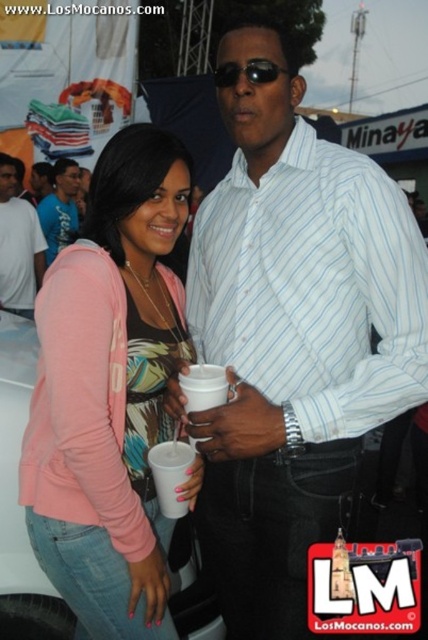
You are at an event and want to place both the white paper cup at center and the sunglasses at center into your bag. Which item will take up more space in your bag?

The sunglasses at center will take up more space in your bag because the white paper cup at center occupies less space than sunglasses at center.

You are at a party and want to grab a drink from the table between the pink cotton shirt at left and the white paper cup at center. Can you reach the cup without moving the shirt?

The pink cotton shirt at left is positioned on the left side of the white paper cup at center, so you can reach the cup without moving the shirt since it is to the right of the shirt.

You are a photographer standing at the camera position. You want to take a closeup photo of the pink cotton shirt at left. Can you do it without moving the shirt or the camera?

The pink cotton shirt at left is 1.45 meters away from the camera, so you can take a closeup photo without moving either since the distance is within a typical camera focus range.